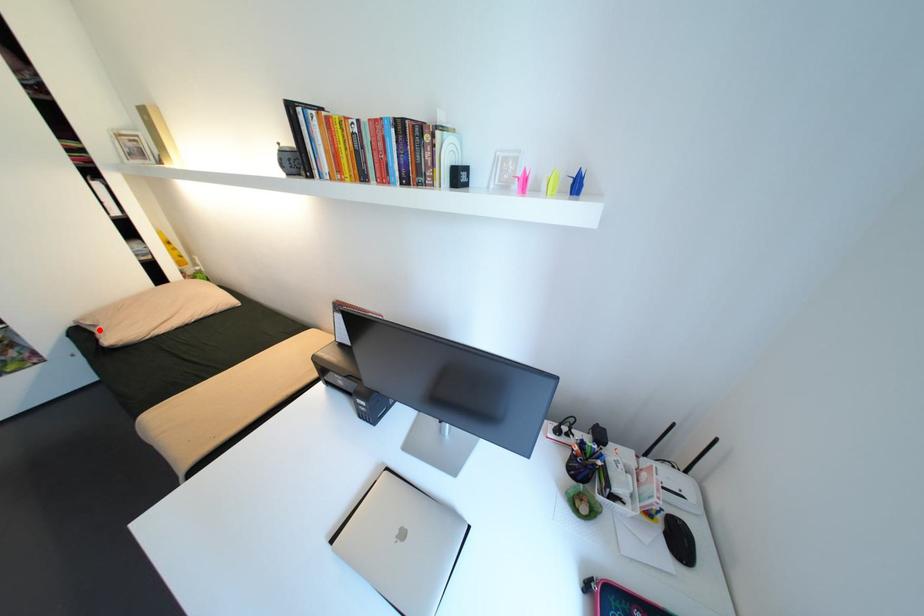
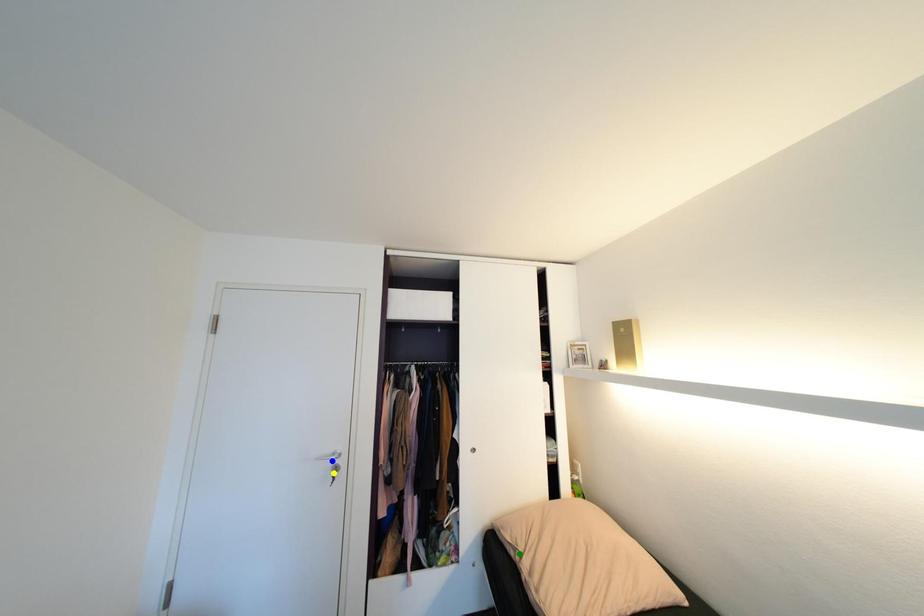
Question: I am providing you with two images of the same scene from different viewpoints. A red point is marked on the first image. You are given multiple points on the second image. Can you choose the point in image 2 that corresponds to the point in image 1?

Choices:
 (A) yellow point
 (B) green point
 (C) blue point

Answer: (B)